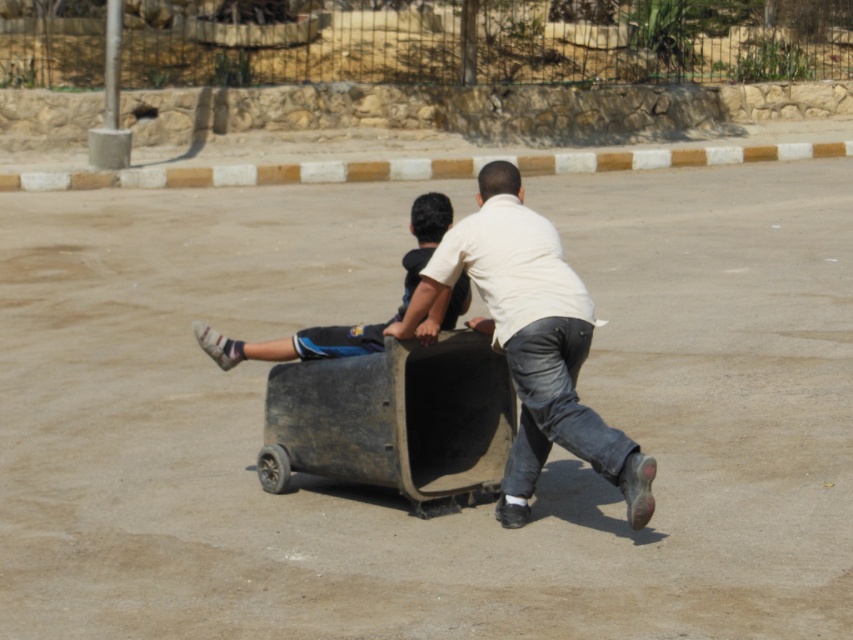
Question: Which object appears closest to the camera in this image?

Choices:
 (A) dark blue fabric pants at center
 (B) rusty metal wagon at center

Answer: (A)

Question: Which object is the closest to the dark blue fabric pants at center?

Choices:
 (A) white matte shirt at center
 (B) rusty metal wagon at center

Answer: (B)

Question: Is rusty metal wagon at center to the right of white matte shirt at center from the viewer's perspective?

Choices:
 (A) yes
 (B) no

Answer: (B)

Question: Observing the image, what is the correct spatial positioning of rusty metal wagon at center in reference to dark blue fabric pants at center?

Choices:
 (A) below
 (B) above

Answer: (A)

Question: Can you confirm if rusty metal wagon at center is positioned to the right of white matte shirt at center?

Choices:
 (A) no
 (B) yes

Answer: (A)

Question: Which is nearer to the dark blue fabric pants at center?

Choices:
 (A) rusty metal wagon at center
 (B) white matte shirt at center

Answer: (A)